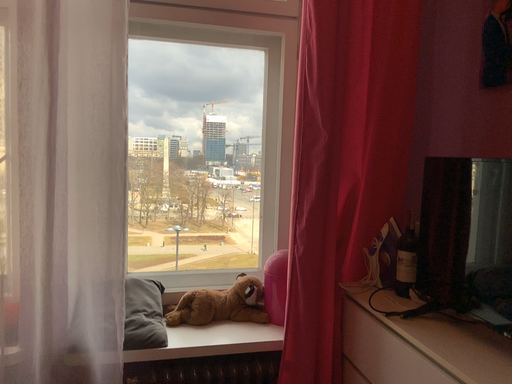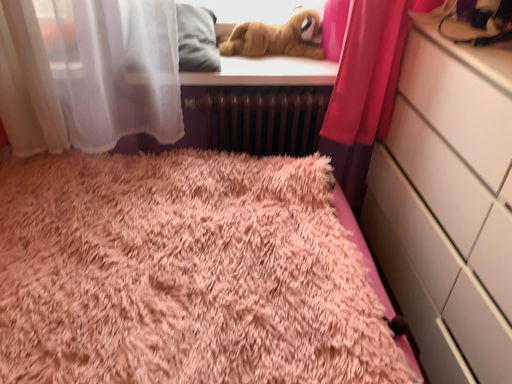
Question: How did the camera likely rotate when shooting the video?

Choices:
 (A) rotated right
 (B) rotated left

Answer: (B)